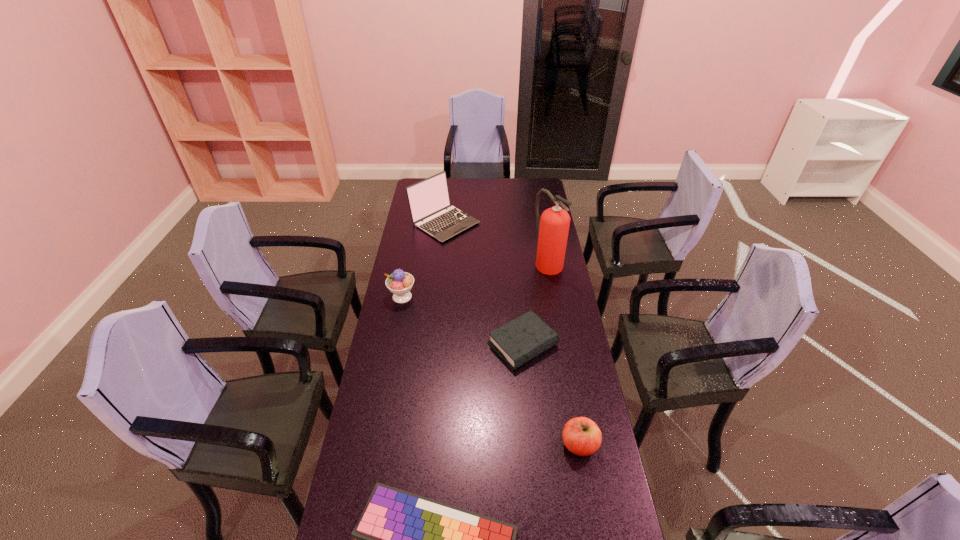
Find the location of `vacant space at the far edge of the desktop`. vacant space at the far edge of the desktop is located at coordinates (466, 187).

Identify the location of blank space at the left edge of the desktop. (405, 328).

This screenshot has width=960, height=540. Identify the location of vacant space at the right edge. (572, 343).

You are a GUI agent. You are given a task and a screenshot of the screen. Output one action in this format:
    pyautogui.click(x=<x>, y=<y>)
    Task: Click on the free space at the far right corner of the desktop
    The image size is (960, 540).
    Given the screenshot: What is the action you would take?
    pyautogui.click(x=525, y=188)

Identify the location of vacant area between the fifth nearest object and the farthest object. The image size is (960, 540). (496, 242).

The width and height of the screenshot is (960, 540). Identify the location of free spot between the third nearest object and the tallest object. (x=535, y=303).

The image size is (960, 540). I want to click on free spot between the laptop_computer and the third nearest object, so (484, 284).

Identify the location of empty location between the tallest object and the second nearest object. This screenshot has width=960, height=540. (564, 353).

Identify the location of free space that is in between the fifth shortest object and the fifth nearest object. click(496, 242).

What are the coordinates of `free space between the icecream and the fire extinguisher` in the screenshot? It's located at (475, 279).